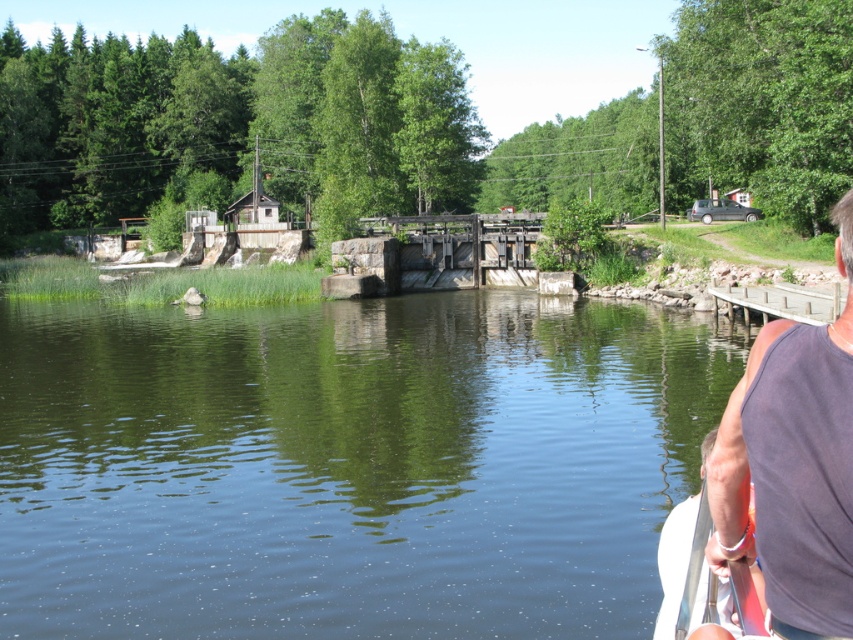
You are standing on the wooden walkway and see the green smooth water at center and the white plastic paddle at right. Which object is closer to your left side?

The green smooth water at center is closer to your left side since it is positioned to the left of the white plastic paddle at right.

You are standing at the center of the waterway scene. You need to locate the dark gray tank top at right. In which direction should you look to find it?

The dark gray tank top at right is located at the right side of the image, so you should look to your right to find it.